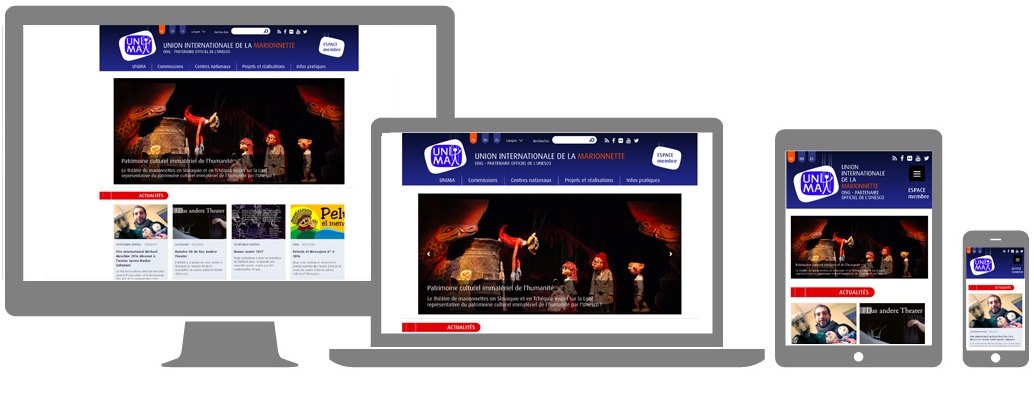
Identify the location of monitor frame. (181, 297).